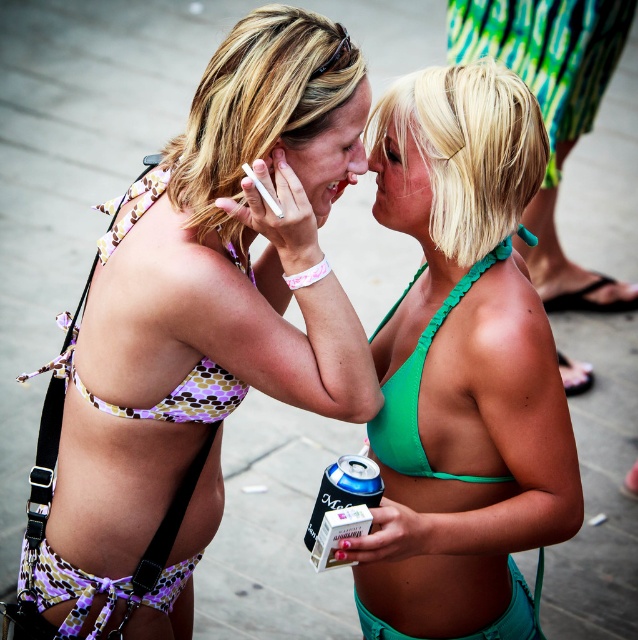
You are a fashion designer analyzing swimwear sizes in the image. Which bikini top from the green matte bikini top at center and the purple polka dot bikini top at upper left is larger?

The green matte bikini top at center is bigger than the purple polka dot bikini top at upper left according to the description.

You are a photographer trying to capture a closeup of the green matte bikini top at center and the printed fabric bikini bottoms at lower left. Which object should you focus on first to ensure it appears sharp in the photo?

The green matte bikini top at center should be focused on first because it is closer to the viewer than the printed fabric bikini bottoms at lower left, ensuring it stays sharp while the background may blur slightly.

You are standing in front of the image and want to reach out to touch the matte green bikini at center. Considering your arm length is 2.5 feet, can you reach it without moving your feet?

The matte green bikini at center is 6.78 feet from viewer, which is farther than your arm length of 2.5 feet. You cannot reach it without moving your feet.